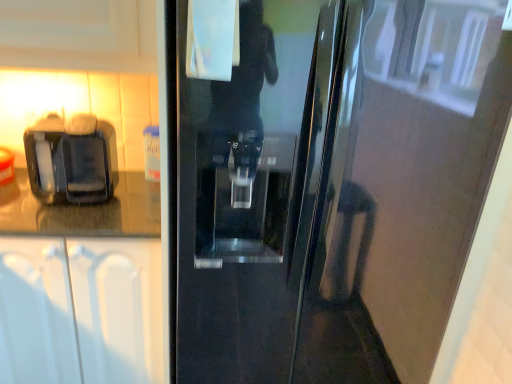
Question: Is glossy black refrigerator at center inside the boundaries of white matte cabinet at left, or outside?

Choices:
 (A) outside
 (B) inside

Answer: (A)

Question: Is glossy black refrigerator at center taller or shorter than white matte cabinet at left?

Choices:
 (A) tall
 (B) short

Answer: (A)

Question: Estimate the real-world distances between objects in this image. Which object is farther from the black plastic coffee machine at left?

Choices:
 (A) white matte cabinet at left
 (B) glossy black refrigerator at center

Answer: (B)

Question: Considering the real-world distances, which object is closest to the glossy black refrigerator at center?

Choices:
 (A) black plastic coffee machine at left
 (B) white matte cabinet at left

Answer: (B)